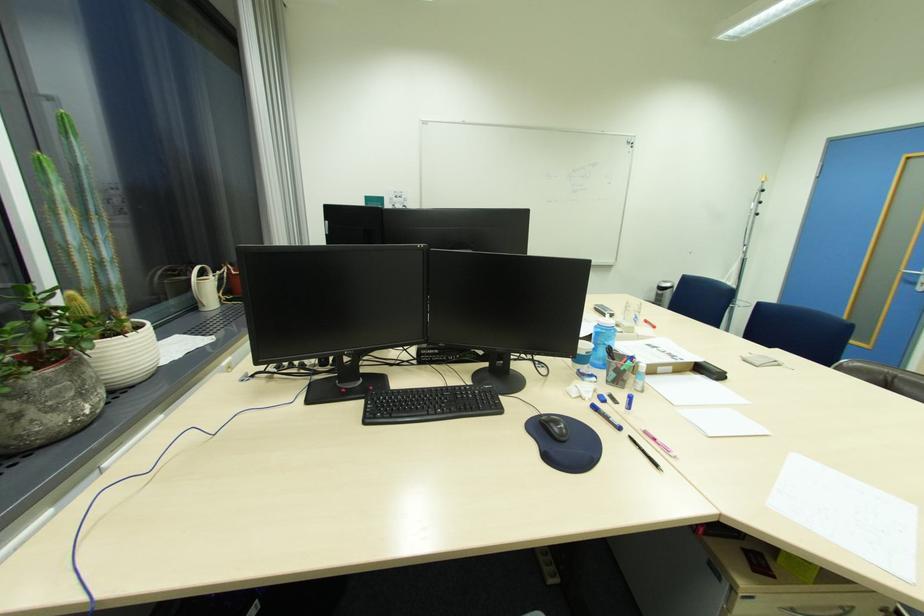
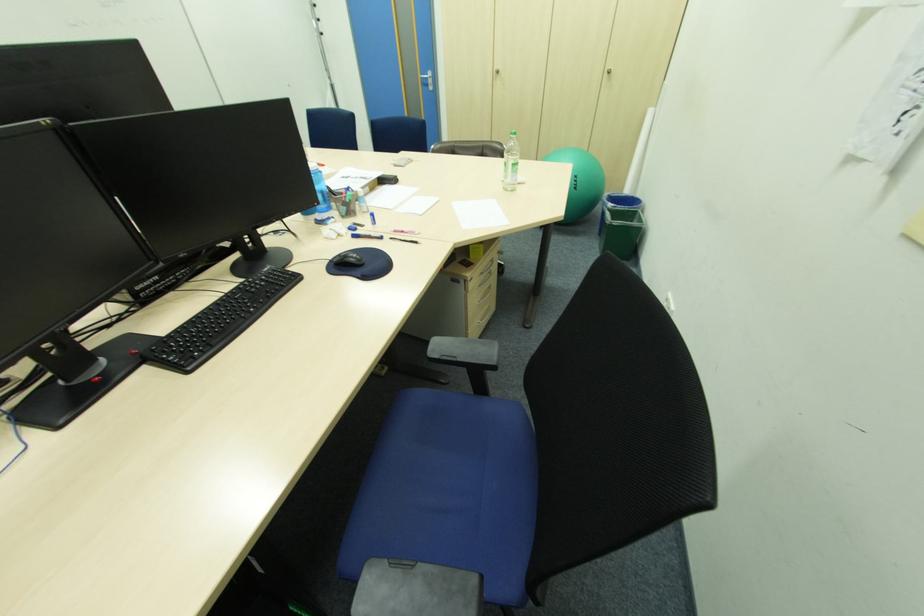
The point at (618, 376) is marked in the first image. Where is the corresponding point in the second image?

(349, 209)